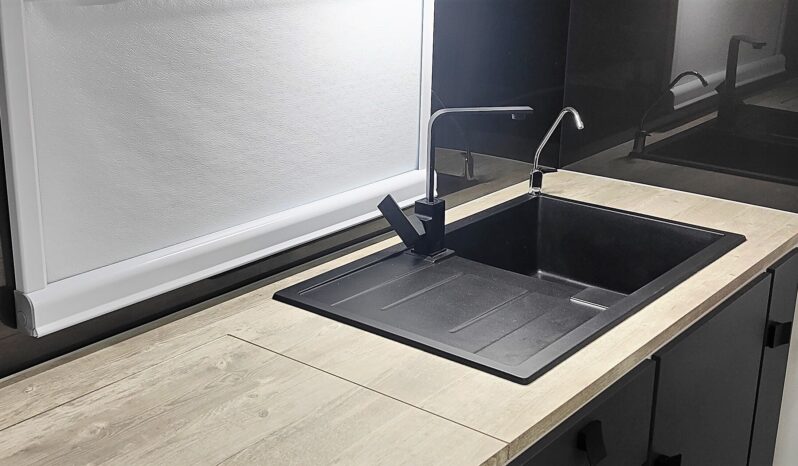
You are a GUI agent. You are given a task and a screenshot of the screen. Output one action in this format:
    pyautogui.click(x=<x>, y=<y>)
    Task: Click on the black surface left of sink
    Image resolution: width=798 pixels, height=466 pixels.
    Given the screenshot: What is the action you would take?
    pyautogui.click(x=480, y=294)